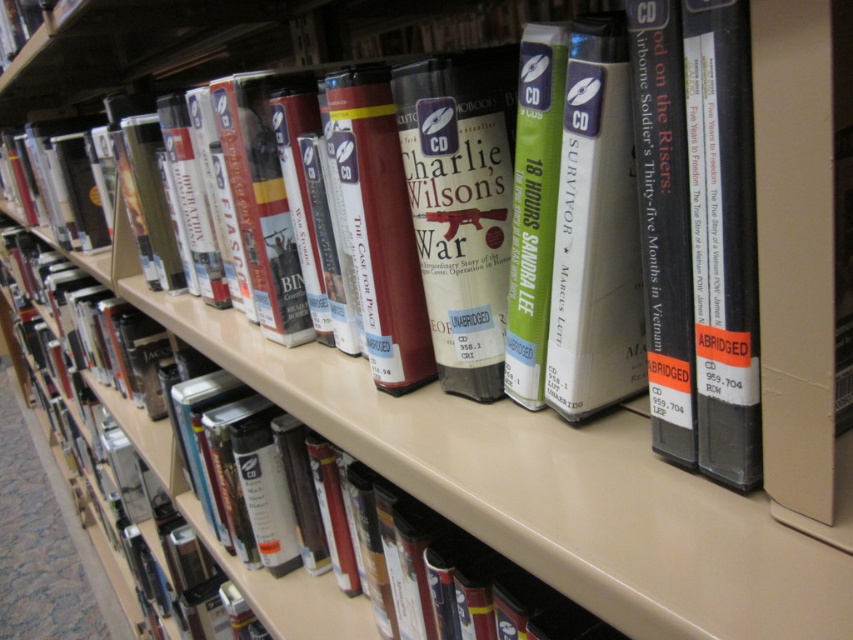
Does matte gray cd at center have a greater height compared to black hardcover book at center?

Indeed, matte gray cd at center has a greater height compared to black hardcover book at center.

Is matte gray cd at center below black hardcover book at center?

No.

Which is in front, point (573, 182) or point (729, 305)?

Point (729, 305) is in front.

Image resolution: width=853 pixels, height=640 pixels. Find the location of `matte gray cd at center`. matte gray cd at center is located at coordinates (595, 230).